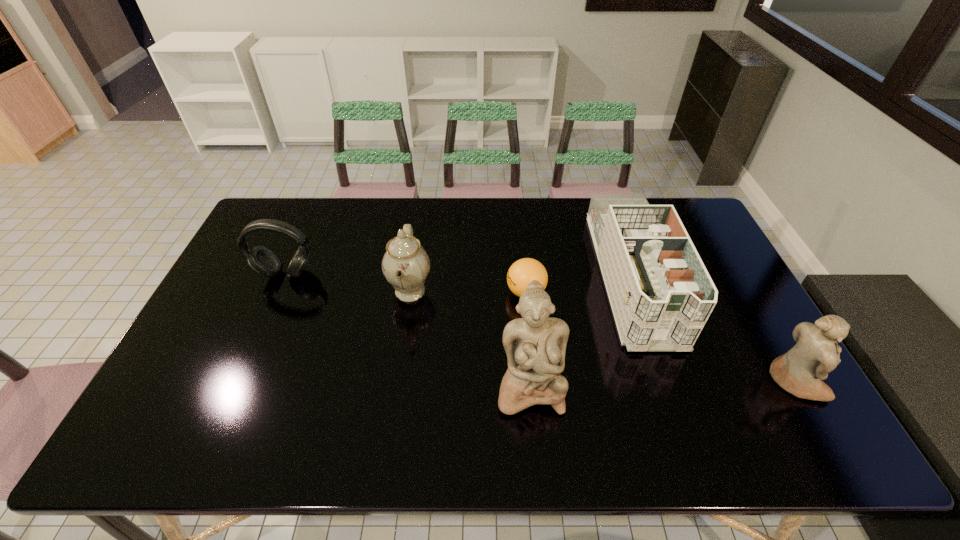
In the image, there is a desktop. Where is `vacant space at the left edge`? The width and height of the screenshot is (960, 540). vacant space at the left edge is located at coordinates (241, 326).

Locate an element on the screen. The height and width of the screenshot is (540, 960). free space at the right edge is located at coordinates (747, 324).

In the image, there is a desktop. Identify the location of free space at the far left corner. Image resolution: width=960 pixels, height=540 pixels. click(x=262, y=234).

This screenshot has width=960, height=540. I want to click on vacant area between the dollhouse and the right figurine, so click(x=712, y=328).

You are a GUI agent. You are given a task and a screenshot of the screen. Output one action in this format:
    pyautogui.click(x=<x>, y=<y>)
    Task: Click on the free space between the ping-pong ball and the fifth object from right to left
    Image resolution: width=960 pixels, height=540 pixels.
    Given the screenshot: What is the action you would take?
    pyautogui.click(x=468, y=292)

Image resolution: width=960 pixels, height=540 pixels. I want to click on empty space between the second object from right to left and the left figurine, so click(580, 332).

At what (x,y) coordinates should I click in order to perform the action: click on free point between the dollhouse and the right figurine. Please return your answer as a coordinate pair (x, y). Image resolution: width=960 pixels, height=540 pixels. Looking at the image, I should click on (712, 328).

Identify the location of free space between the leftmost object and the left figurine. This screenshot has height=540, width=960. (408, 330).

Identify the location of free space between the taller figurine and the second object from left to right. (470, 339).

This screenshot has width=960, height=540. In order to click on free spot between the taller figurine and the shorter figurine in this screenshot , I will do `click(661, 384)`.